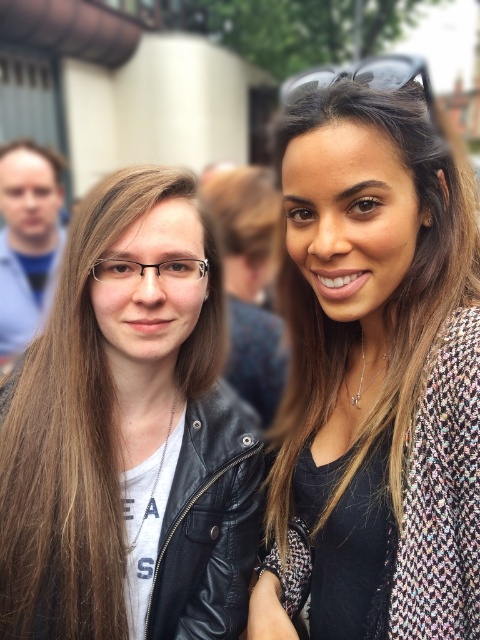
Which is more to the right, black leather jacket at left or matte blue shirt at left?

black leather jacket at left is more to the right.

This screenshot has height=640, width=480. Find the location of `black leather jacket at left`. black leather jacket at left is located at coordinates (130, 435).

Is multicolored tweed jacket at upper right below matte blue shirt at left?

Yes.

Who is more forward, (384, 580) or (46, 289)?

Positioned in front is point (384, 580).

At what (x,y) coordinates should I click in order to perform the action: click on multicolored tweed jacket at upper right. Please return your answer as a coordinate pair (x, y). Looking at the image, I should click on (357, 339).

Is matte blue shirt at left wider than black plastic goggles at upper center?

In fact, matte blue shirt at left might be narrower than black plastic goggles at upper center.

Can you confirm if matte blue shirt at left is positioned to the left of black plastic goggles at upper center?

Correct, you'll find matte blue shirt at left to the left of black plastic goggles at upper center.

Is point (3, 333) positioned after point (397, 76)?

That is True.

I want to click on matte blue shirt at left, so click(x=26, y=240).